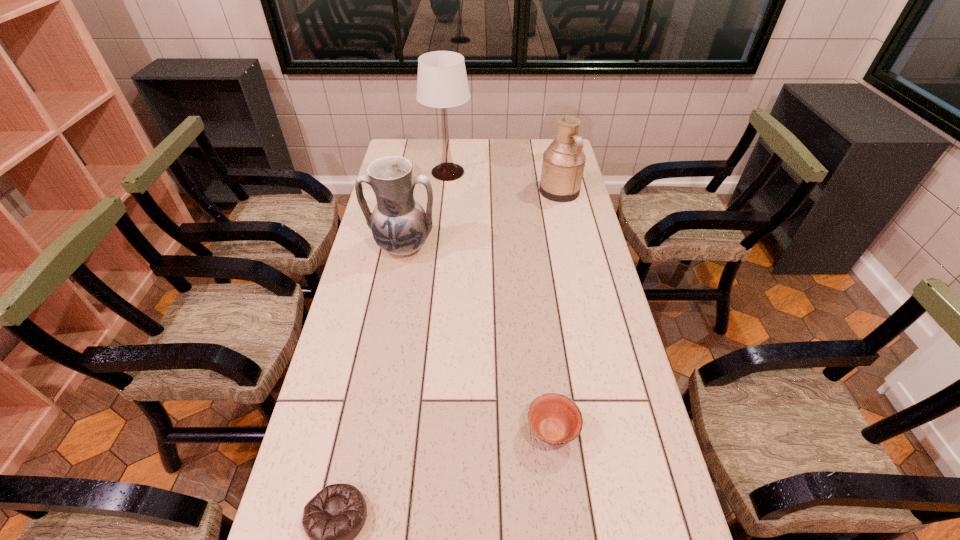
Find the location of `vacant region located 0.210m on the left of the fourth object from left to right`. vacant region located 0.210m on the left of the fourth object from left to right is located at coordinates (438, 430).

Where is `object that is at the far edge`? The height and width of the screenshot is (540, 960). object that is at the far edge is located at coordinates (442, 82).

Where is `object that is at the left edge`? The image size is (960, 540). object that is at the left edge is located at coordinates (400, 226).

Find the location of a particular element. This screenshot has width=960, height=540. object that is at the right edge is located at coordinates (563, 163).

Identify the location of vacant space at the left edge. This screenshot has width=960, height=540. pyautogui.click(x=337, y=384).

The width and height of the screenshot is (960, 540). I want to click on vacant area at the right edge, so click(x=633, y=434).

Locate an element on the screen. free area in between the table lamp and the rightmost object is located at coordinates (504, 182).

This screenshot has height=540, width=960. Identify the location of vacant space that is in between the nearer pitcher and the bowl. (477, 339).

Where is `vacant region between the table lamp and the left pitcher`? The height and width of the screenshot is (540, 960). vacant region between the table lamp and the left pitcher is located at coordinates (425, 210).

You are a GUI agent. You are given a task and a screenshot of the screen. Output one action in this format:
    pyautogui.click(x=<x>, y=<y>)
    Task: Click on the empty location between the farther pitcher and the third nearest object
    
    Given the screenshot: What is the action you would take?
    pyautogui.click(x=481, y=219)